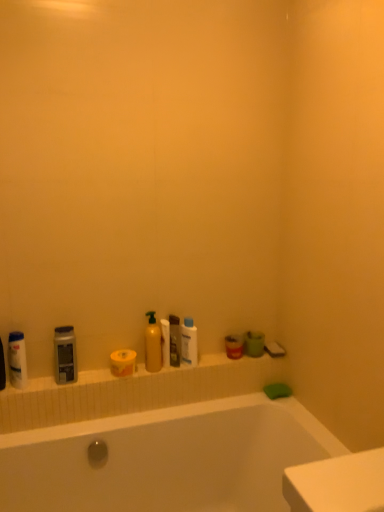
This screenshot has height=512, width=384. What are the coordinates of `free space between white matte bottle at left, positioned as the first mouthwash in left-to-right order, and yellow matte toilet paper at center, marked as the second toilet paper in a right-to-left arrangement` in the screenshot? It's located at tap(72, 381).